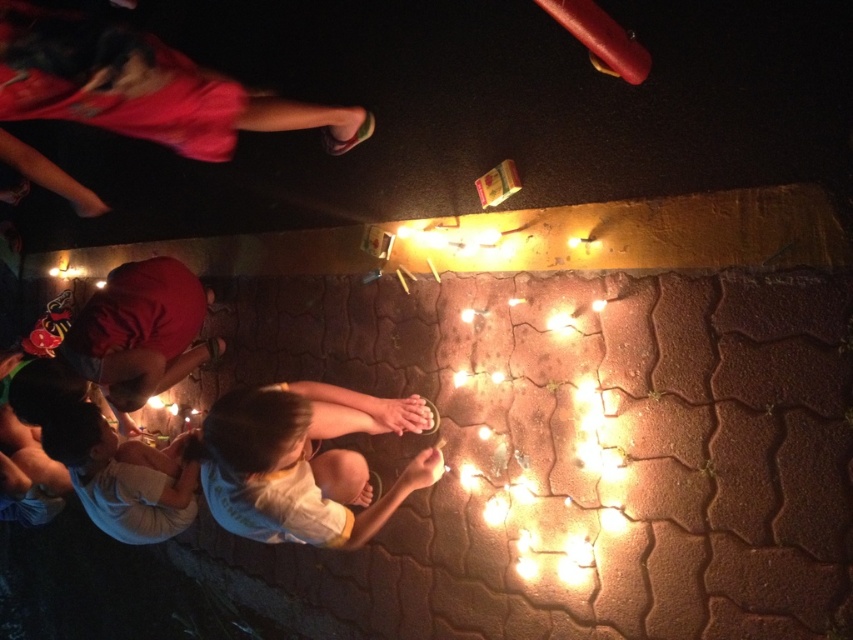
Question: Which is nearer to the white cotton shirt at lower left?

Choices:
 (A) white cotton shirt at center
 (B) matte red shirt at lower left

Answer: (B)

Question: From the image, what is the correct spatial relationship of white cotton shirt at center in relation to matte red shirt at lower left?

Choices:
 (A) right
 (B) left

Answer: (A)

Question: Which point is closer to the camera taking this photo?

Choices:
 (A) (247, 534)
 (B) (131, 451)
 (C) (97, 376)

Answer: (A)

Question: Does white cotton shirt at center appear over white cotton shirt at lower left?

Choices:
 (A) no
 (B) yes

Answer: (B)

Question: Which point is farther from the camera taking this photo?

Choices:
 (A) (309, 404)
 (B) (96, 515)
 (C) (103, 369)

Answer: (C)

Question: Is white cotton shirt at center above matte red shirt at lower left?

Choices:
 (A) yes
 (B) no

Answer: (B)